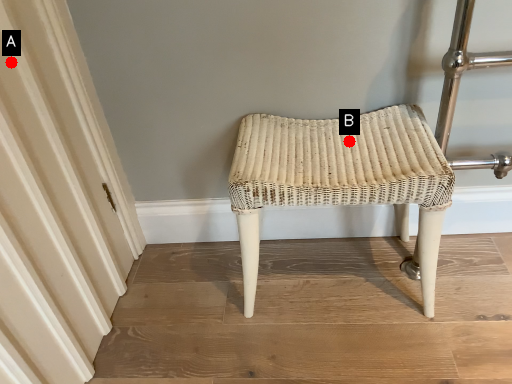
Question: Two points are circled on the image, labeled by A and B beside each circle. Among these points, which one is nearest to the camera?

Choices:
 (A) A is closer
 (B) B is closer

Answer: (A)